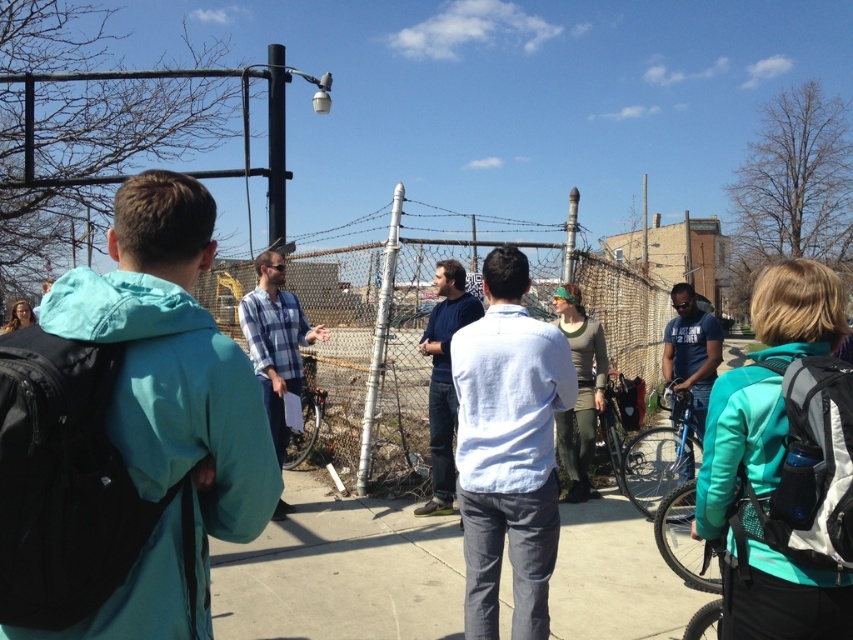
Question: Can you confirm if plaid shirt at center is positioned to the left of blue cotton shirt at center?

Choices:
 (A) yes
 (B) no

Answer: (A)

Question: Is the position of white cotton shirt at center more distant than that of green knitted hat at center?

Choices:
 (A) yes
 (B) no

Answer: (B)

Question: Is dark blue sweater at center above blue cotton shirt at center?

Choices:
 (A) yes
 (B) no

Answer: (B)

Question: Which object is farther from the camera taking this photo?

Choices:
 (A) teal fabric backpack at lower right
 (B) white cotton shirt at center
 (C) blue cotton shirt at center
 (D) plaid shirt at center

Answer: (C)

Question: Which point appears farthest from the camera in this image?

Choices:
 (A) (456, 292)
 (B) (701, 324)
 (C) (32, 380)
 (D) (831, 588)

Answer: (B)

Question: Which point is farther from the camera taking this photo?

Choices:
 (A) coord(428,417)
 (B) coord(767,490)
 (C) coord(689,388)

Answer: (C)